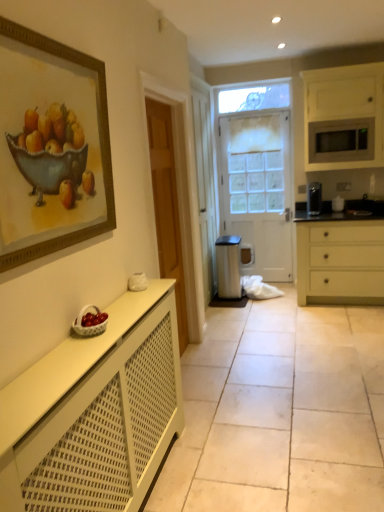
What do you see at coordinates (340, 259) in the screenshot?
I see `matte cream drawer at right` at bounding box center [340, 259].

This screenshot has height=512, width=384. I want to click on satin silver trash can at center, so click(x=228, y=266).

This screenshot has height=512, width=384. What do you see at coordinates (258, 181) in the screenshot? I see `white frosted glass door at center` at bounding box center [258, 181].

I want to click on white matte radiator at lower left, which is counted as the 2th cabinetry, starting from the right, so click(x=95, y=412).

The width and height of the screenshot is (384, 512). Describe the element at coordinates (341, 140) in the screenshot. I see `matte silver microwave at upper right` at that location.

What do you see at coordinates (345, 113) in the screenshot? The image size is (384, 512). I see `white matte microwave at upper right, acting as the 1th cabinetry starting from the right` at bounding box center [345, 113].

Find the location of a particular element. This screenshot has width=384, height=512. matte cream drawer at right is located at coordinates (340, 259).

The image size is (384, 512). In the image, there is a matte silver microwave at upper right. What are the coordinates of `the chest of drawers below it (from a real-world perspective)` in the screenshot? It's located at (340, 259).

Are matte silver microwave at upper right and matte cream drawer at right making contact?

No, matte silver microwave at upper right is not beside matte cream drawer at right.

What's the angular difference between matte silver microwave at upper right and matte cream drawer at right's facing directions?

There is a 0.867-degree angle between the facing directions of matte silver microwave at upper right and matte cream drawer at right.

Is the surface of black matte sink at right in direct contact with white matte microwave at upper right, the second cabinetry when ordered from left to right?

black matte sink at right is not next to white matte microwave at upper right, the second cabinetry when ordered from left to right, and they're not touching.

In the scene shown: From a real-world perspective, is black matte sink at right above or below white matte microwave at upper right, the 2th cabinetry from the front?

black matte sink at right is situated lower than white matte microwave at upper right, the 2th cabinetry from the front, in the real world.

Considering the relative sizes of black matte sink at right and white matte microwave at upper right, acting as the 1th cabinetry starting from the right, in the image provided, is black matte sink at right shorter than white matte microwave at upper right, acting as the 1th cabinetry starting from the right,?

Correct, black matte sink at right is not as tall as white matte microwave at upper right, acting as the 1th cabinetry starting from the right.

From the black matte sink at right, count the 1st cabinetry to the left and point to it. Please provide its 2D coordinates.

[(345, 113)]

From a real-world perspective, is satin silver trash can at center positioned over white frosted glass door at center based on gravity?

No, from a real-world perspective, satin silver trash can at center is not above white frosted glass door at center.

From the image's perspective, is satin silver trash can at center below white frosted glass door at center?

Correct, satin silver trash can at center appears lower than white frosted glass door at center in the image.

What's the angular difference between satin silver trash can at center and white frosted glass door at center's facing directions?

2.9 degrees.

Based on the photo, which is correct: satin silver trash can at center is inside white frosted glass door at center, or outside of it?

satin silver trash can at center is spatially situated outside white frosted glass door at center.

From the image's perspective, is gold-framed print at upper left located above or below matte silver microwave at upper right?

gold-framed print at upper left is below matte silver microwave at upper right.

Considering the relative sizes of gold-framed print at upper left and matte silver microwave at upper right in the image provided, is gold-framed print at upper left thinner than matte silver microwave at upper right?

Yes.

Identify the location of microwave oven beneath the gold-framed print at upper left (from a real-world perspective). The image size is (384, 512). (341, 140).

Is gold-framed print at upper left oriented away from matte silver microwave at upper right?

No, gold-framed print at upper left is not facing away from matte silver microwave at upper right.

This screenshot has width=384, height=512. I want to click on chest of drawers behind the white matte microwave at upper right, the 2th cabinetry from the front, so click(340, 259).

Which of these two, white matte microwave at upper right, the 2th cabinetry from the front, or matte cream drawer at right, stands taller?

matte cream drawer at right.

Is white matte microwave at upper right, acting as the 1th cabinetry starting from the right, looking in the opposite direction of matte cream drawer at right?

No, white matte microwave at upper right, acting as the 1th cabinetry starting from the right, is not facing away from matte cream drawer at right.

Which of these two, white matte microwave at upper right, the 1th cabinetry in the back-to-front sequence, or matte cream drawer at right, is wider?

With larger width is matte cream drawer at right.

Where is `picture frame in front of the white frosted glass door at center`? The image size is (384, 512). picture frame in front of the white frosted glass door at center is located at coordinates (50, 152).

Considering the positions of objects white frosted glass door at center and gold-framed print at upper left in the image provided, who is more to the right, white frosted glass door at center or gold-framed print at upper left?

white frosted glass door at center is more to the right.

Is white frosted glass door at center surrounding gold-framed print at upper left?

No, gold-framed print at upper left is not surrounded by white frosted glass door at center.

Is white frosted glass door at center further to camera compared to gold-framed print at upper left?

Yes.

Is matte cream drawer at right bigger or smaller than satin silver trash can at center?

matte cream drawer at right is bigger than satin silver trash can at center.

In the scene shown: Is matte cream drawer at right inside or outside of satin silver trash can at center?

matte cream drawer at right is outside satin silver trash can at center.

Between matte cream drawer at right and satin silver trash can at center, which one has larger width?

matte cream drawer at right is wider.

Identify the location of chest of drawers below the matte silver microwave at upper right (from the image's perspective). This screenshot has height=512, width=384. (340, 259).

Where is `sink below the white matte microwave at upper right, the 2th cabinetry from the front (from a real-world perspective)`? The image size is (384, 512). sink below the white matte microwave at upper right, the 2th cabinetry from the front (from a real-world perspective) is located at coordinates (366, 206).

From the image, which object appears to be nearer to gold-framed print at upper left, white matte microwave at upper right, the second cabinetry when ordered from left to right, or matte cream drawer at right?

matte cream drawer at right lies closer to gold-framed print at upper left than the other object.

From the image, which object appears to be farther from black matte sink at right, white matte microwave at upper right, the 1th cabinetry in the back-to-front sequence, or gold-framed print at upper left?

Based on the image, gold-framed print at upper left appears to be further to black matte sink at right.

When comparing their distances from satin silver trash can at center, does white frosted glass door at center or black matte sink at right seem further?

The object further to satin silver trash can at center is black matte sink at right.

Estimate the real-world distances between objects in this image. Which object is further from matte cream drawer at right, white frosted glass door at center or gold-framed print at upper left?

gold-framed print at upper left is positioned further to the anchor matte cream drawer at right.

From the image, which object appears to be farther from matte silver microwave at upper right, white matte radiator at lower left, acting as the 1th cabinetry starting from the bottom, or black matte sink at right?

The object further to matte silver microwave at upper right is white matte radiator at lower left, acting as the 1th cabinetry starting from the bottom.

Based on their spatial positions, is black matte sink at right or white matte microwave at upper right, which is the 2th cabinetry from bottom to top, closer to matte cream drawer at right?

black matte sink at right is positioned closer to the anchor matte cream drawer at right.

Considering their positions, is white matte radiator at lower left, which ranks as the first cabinetry in left-to-right order, positioned closer to gold-framed print at upper left than matte cream drawer at right?

white matte radiator at lower left, which ranks as the first cabinetry in left-to-right order.

Estimate the real-world distances between objects in this image. Which object is closer to white matte radiator at lower left, which is counted as the 2th cabinetry, starting from the right, matte cream drawer at right or white matte microwave at upper right, the 2th cabinetry from the front?

The object closer to white matte radiator at lower left, which is counted as the 2th cabinetry, starting from the right, is matte cream drawer at right.

At what (x,y) coordinates should I click in order to perform the action: click on microwave oven positioned between gold-framed print at upper left and black matte sink at right from near to far. Please return your answer as a coordinate pair (x, y). The height and width of the screenshot is (512, 384). Looking at the image, I should click on click(x=341, y=140).

Identify the location of sink between matte silver microwave at upper right and matte cream drawer at right vertically. point(366,206).

In order to click on door between white matte microwave at upper right, the 2th cabinetry from the front, and matte cream drawer at right in the up-down direction in this screenshot , I will do `click(258, 181)`.

Where is `the chest of drawers located between white matte radiator at lower left, which ranks as the first cabinetry in left-to-right order, and satin silver trash can at center in the depth direction`? The image size is (384, 512). the chest of drawers located between white matte radiator at lower left, which ranks as the first cabinetry in left-to-right order, and satin silver trash can at center in the depth direction is located at coordinates (340, 259).